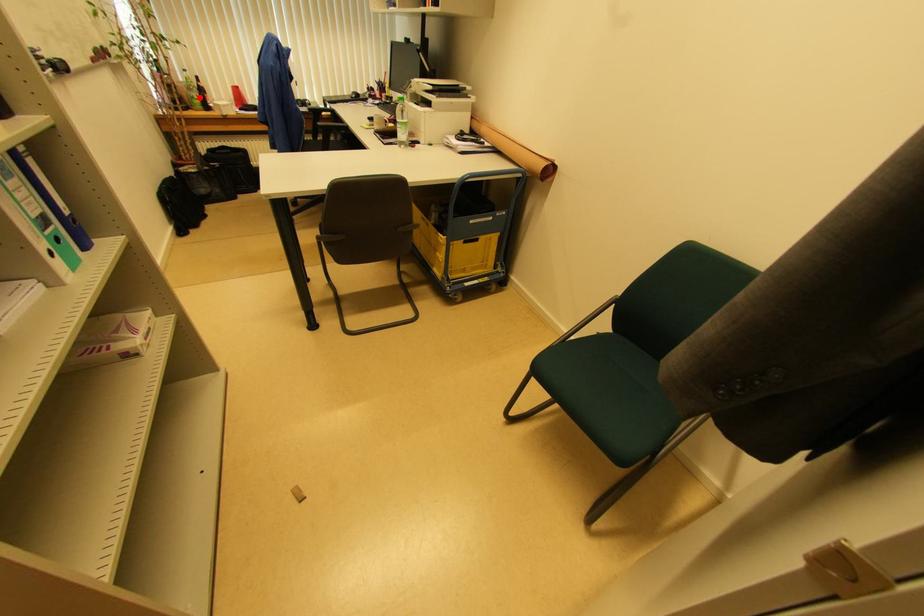
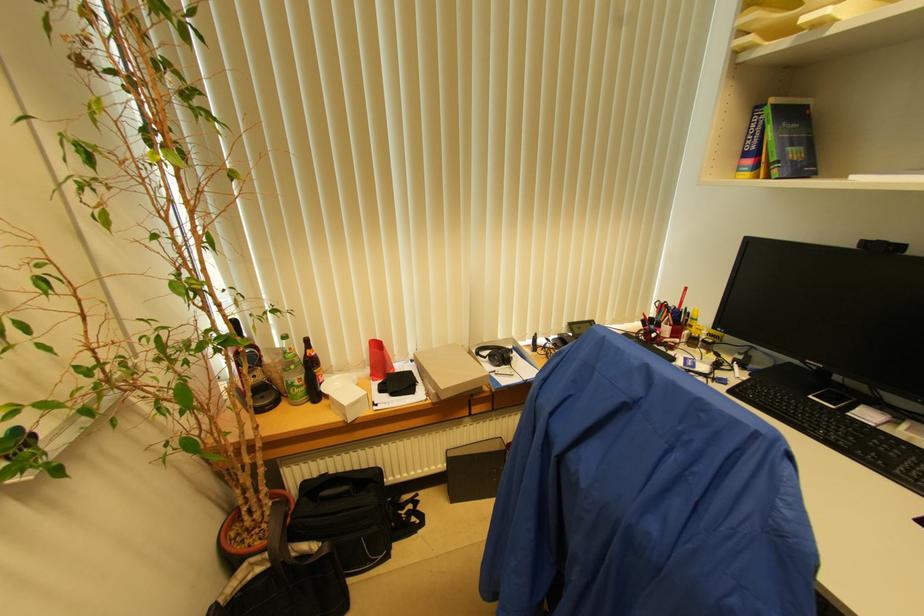
Locate, in the second image, the point that corresponds to the highlighted location in the first image.

(304, 379)